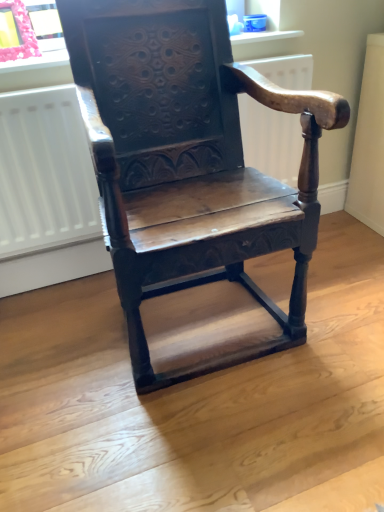
Question: Considering the relative positions of white matte radiator at center and pink fabric at upper left in the image provided, is white matte radiator at center to the right of pink fabric at upper left from the viewer's perspective?

Choices:
 (A) no
 (B) yes

Answer: (B)

Question: From the image's perspective, is white matte radiator at center located beneath pink fabric at upper left?

Choices:
 (A) yes
 (B) no

Answer: (A)

Question: Does white matte radiator at center have a lesser width compared to pink fabric at upper left?

Choices:
 (A) yes
 (B) no

Answer: (A)

Question: From a real-world perspective, is white matte radiator at center positioned over pink fabric at upper left based on gravity?

Choices:
 (A) yes
 (B) no

Answer: (B)

Question: Is white matte radiator at center in contact with pink fabric at upper left?

Choices:
 (A) yes
 (B) no

Answer: (B)

Question: From the image's perspective, relative to wooden carved chair at center, is matte plastic window sill at upper center above or below?

Choices:
 (A) above
 (B) below

Answer: (A)

Question: Considering the positions of matte plastic window sill at upper center and wooden carved chair at center in the image, is matte plastic window sill at upper center taller or shorter than wooden carved chair at center?

Choices:
 (A) short
 (B) tall

Answer: (A)

Question: From a real-world perspective, is matte plastic window sill at upper center physically located above or below wooden carved chair at center?

Choices:
 (A) above
 (B) below

Answer: (A)

Question: Is matte plastic window sill at upper center in front of or behind wooden carved chair at center in the image?

Choices:
 (A) front
 (B) behind

Answer: (B)

Question: In terms of size, does white matte radiator at center appear bigger or smaller than pink fabric at upper left?

Choices:
 (A) small
 (B) big

Answer: (B)

Question: Is white matte radiator at center inside or outside of pink fabric at upper left?

Choices:
 (A) outside
 (B) inside

Answer: (A)

Question: From a real-world perspective, relative to pink fabric at upper left, is white matte radiator at center vertically above or below?

Choices:
 (A) above
 (B) below

Answer: (B)

Question: Looking at their shapes, would you say white matte radiator at center is wider or thinner than pink fabric at upper left?

Choices:
 (A) thin
 (B) wide

Answer: (A)

Question: Considering the positions of pink fabric at upper left and matte plastic window sill at upper center in the image, is pink fabric at upper left bigger or smaller than matte plastic window sill at upper center?

Choices:
 (A) big
 (B) small

Answer: (B)

Question: Considering the positions of pink fabric at upper left and matte plastic window sill at upper center in the image, is pink fabric at upper left wider or thinner than matte plastic window sill at upper center?

Choices:
 (A) wide
 (B) thin

Answer: (B)